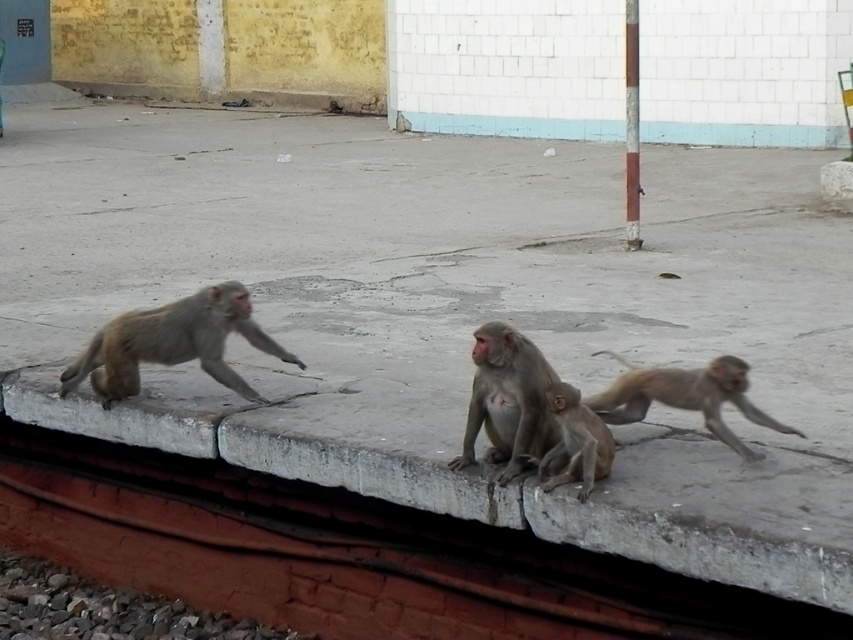
Who is positioned more to the right, light brown fur monkey at center or brown fur monkey at right?

brown fur monkey at right is more to the right.

Is light brown fur monkey at center smaller than brown fur monkey at right?

Indeed, light brown fur monkey at center has a smaller size compared to brown fur monkey at right.

Between point (505, 368) and point (761, 419), which one is positioned behind?

Point (761, 419)

The height and width of the screenshot is (640, 853). Identify the location of light brown fur monkey at center. (508, 401).

Between light brown fur monkey at left and smooth concrete pole at upper right, which one is positioned lower?

light brown fur monkey at left

Is point (154, 323) positioned after point (628, 145)?

No, it is in front of (628, 145).

Find the location of a particular element. light brown fur monkey at left is located at coordinates (172, 342).

How much distance is there between light brown fur monkey at left and brown fur monkey at right?

light brown fur monkey at left and brown fur monkey at right are 5.52 feet apart.

Can you confirm if light brown fur monkey at left is shorter than brown fur monkey at right?

No.

Is point (79, 371) positioned after point (689, 397)?

Yes.

You are a GUI agent. You are given a task and a screenshot of the screen. Output one action in this format:
    pyautogui.click(x=<x>, y=<y>)
    Task: Click on the light brown fur monkey at left
    
    Given the screenshot: What is the action you would take?
    pyautogui.click(x=172, y=342)